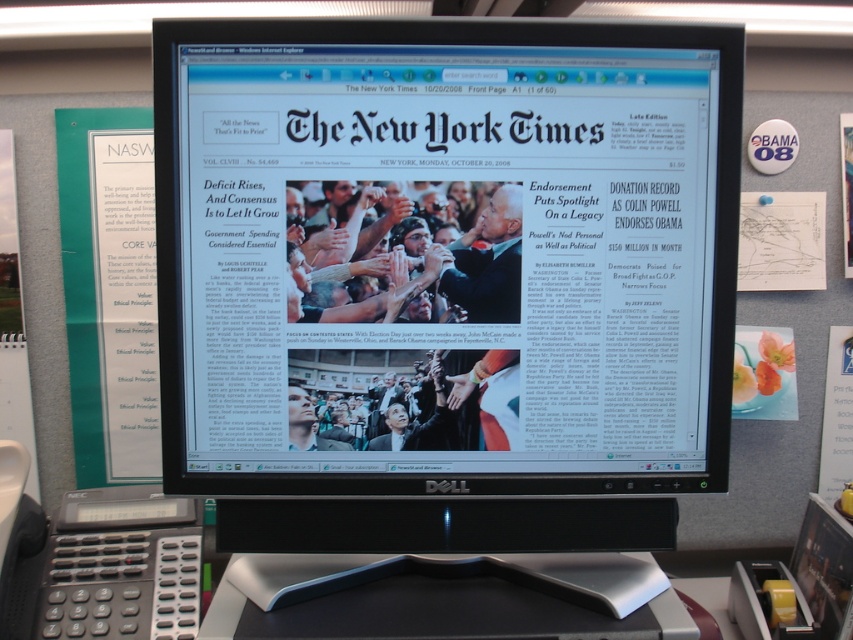
Between point (364, 346) and point (512, 634), which one is positioned in front?

Point (512, 634)

Is point (526, 380) positioned behind point (416, 620)?

Yes, point (526, 380) is farther from viewer.

Image resolution: width=853 pixels, height=640 pixels. In order to click on black plastic monitor at center in this screenshot , I will do `click(445, 280)`.